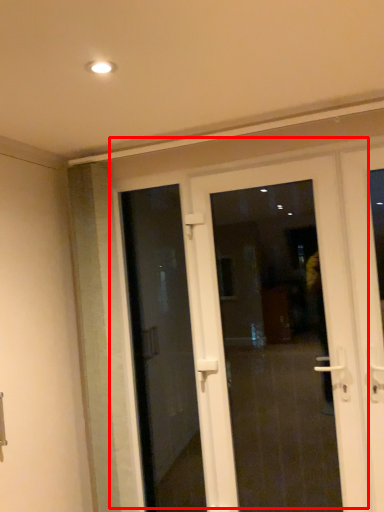
Question: In this image, where is door (annotated by the red box) located relative to door?

Choices:
 (A) right
 (B) left

Answer: (A)